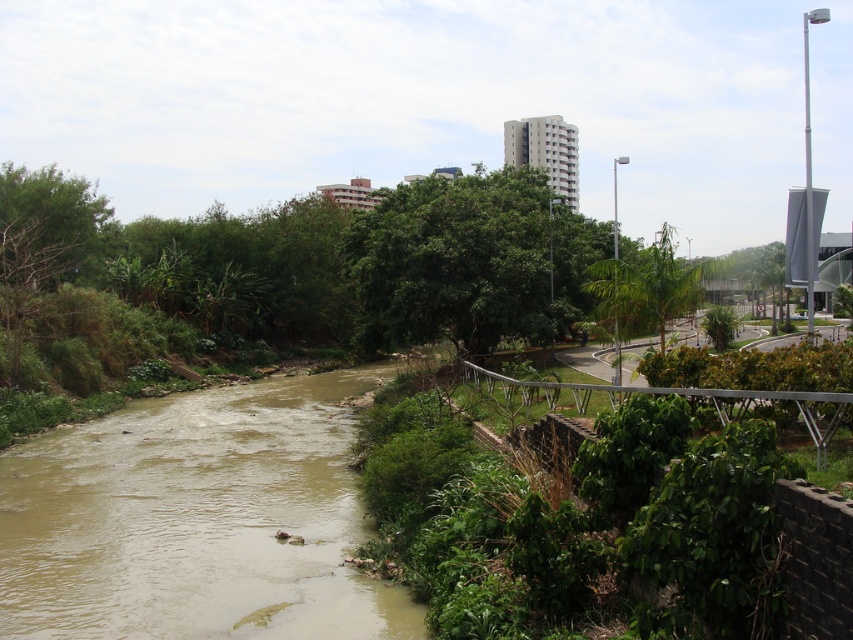
Measure the distance between brown muddy water at center and camera.

brown muddy water at center and camera are 8.33 meters apart from each other.

This screenshot has height=640, width=853. I want to click on brown muddy water at center, so click(x=196, y=520).

Where is `brown muddy water at center`? The height and width of the screenshot is (640, 853). brown muddy water at center is located at coordinates (196, 520).

The width and height of the screenshot is (853, 640). In order to click on brown muddy water at center in this screenshot , I will do `click(196, 520)`.